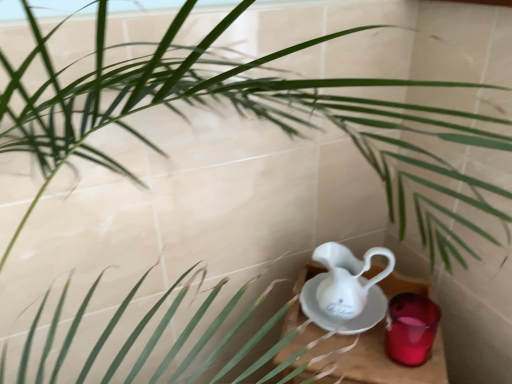
You are a GUI agent. You are given a task and a screenshot of the screen. Output one action in this format:
    pyautogui.click(x=<x>, y=<y>)
    Task: Click on the free space on the front side of white porcelain jug at lower right
    This screenshot has width=512, height=384.
    Given the screenshot: What is the action you would take?
    pyautogui.click(x=359, y=365)